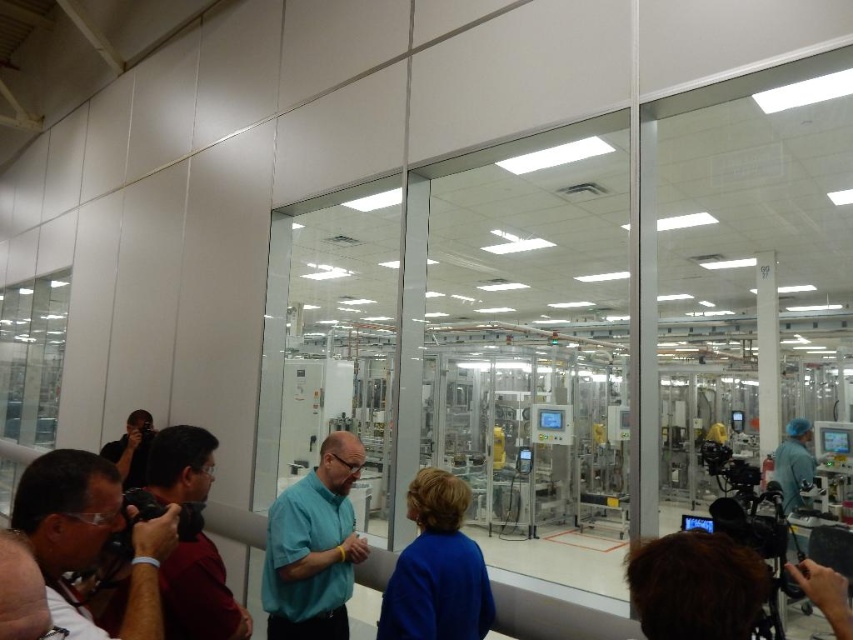
Question: Which point is closer to the camera?

Choices:
 (A) matte black camera at lower left
 (B) matte black camera at left

Answer: (A)

Question: Is matte black camera at lower left smaller than matte teal shirt at center?

Choices:
 (A) no
 (B) yes

Answer: (B)

Question: Which object appears closest to the camera in this image?

Choices:
 (A) matte black camera at left
 (B) matte black camera at lower left

Answer: (B)

Question: Which object is the closest to the matte black camera at left?

Choices:
 (A) matte black camera at lower left
 (B) matte teal shirt at center

Answer: (A)

Question: Does matte black camera at lower left appear on the left side of matte teal shirt at center?

Choices:
 (A) yes
 (B) no

Answer: (A)

Question: Does matte black camera at lower left appear on the right side of matte black camera at left?

Choices:
 (A) yes
 (B) no

Answer: (B)